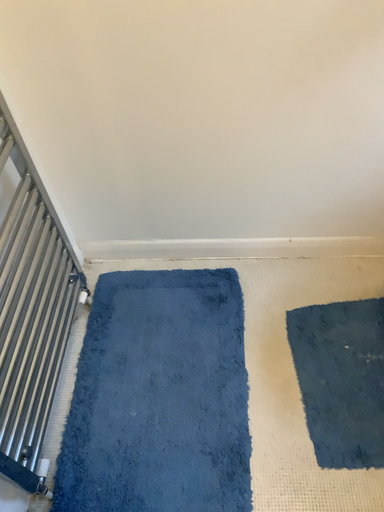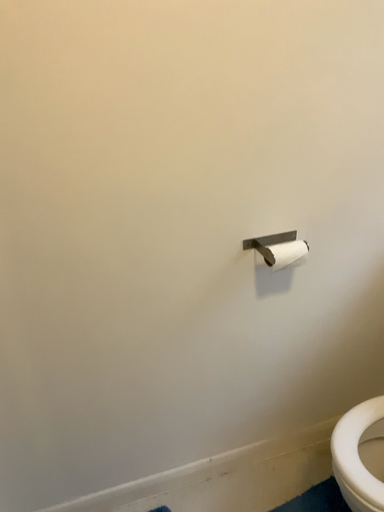
Question: How did the camera likely rotate when shooting the video?

Choices:
 (A) rotated right
 (B) rotated left

Answer: (A)